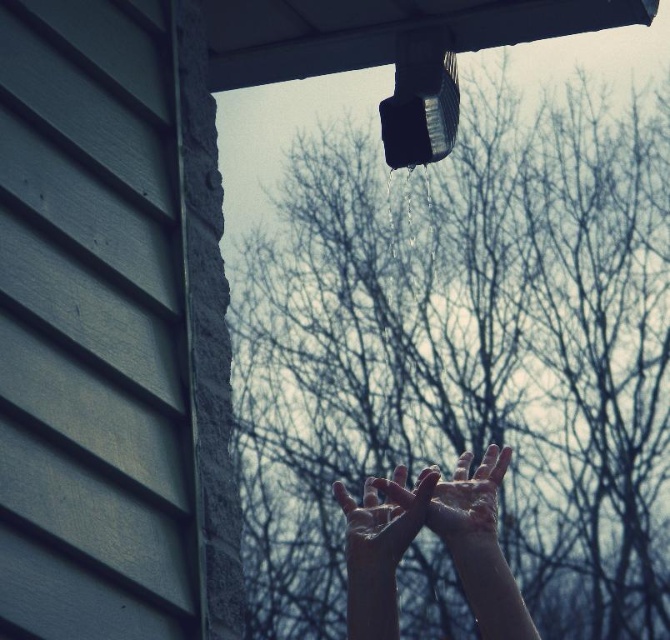
Describe the element at coordinates (383, 522) in the screenshot. I see `wet skin hands at center` at that location.

Is wet skin hands at center smaller than smooth skin hands at center?

Actually, wet skin hands at center might be larger than smooth skin hands at center.

Is point (389, 548) in front of point (450, 500)?

Yes, it is in front of point (450, 500).

I want to click on wet skin hands at center, so click(383, 522).

Looking at this image, can you confirm if slightly wet skin at center is bigger than wet skin hands at center?

Correct, slightly wet skin at center is larger in size than wet skin hands at center.

Does slightly wet skin at center appear over wet skin hands at center?

Actually, slightly wet skin at center is below wet skin hands at center.

Identify the location of slightly wet skin at center. Image resolution: width=670 pixels, height=640 pixels. (440, 538).

Who is positioned more to the left, slightly wet skin at center or smooth skin hands at center?

Positioned to the left is slightly wet skin at center.

Does slightly wet skin at center have a lesser width compared to smooth skin hands at center?

No.

You are a GUI agent. You are given a task and a screenshot of the screen. Output one action in this format:
    pyautogui.click(x=<x>, y=<y>)
    Task: Click on the slightly wet skin at center
    This screenshot has height=640, width=670.
    Given the screenshot: What is the action you would take?
    pyautogui.click(x=440, y=538)